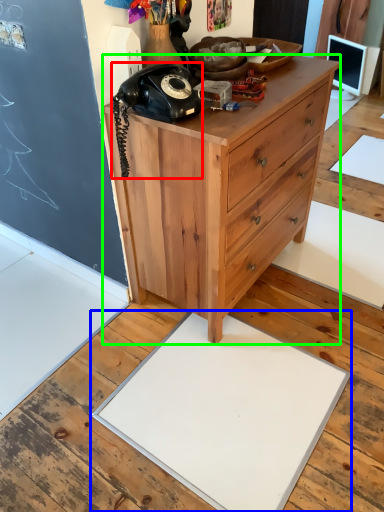
Question: Which is nearer to the corded phone (highlighted by a red box)? slate (highlighted by a blue box) or chest of drawers (highlighted by a green box).

Choices:
 (A) slate
 (B) chest of drawers

Answer: (B)